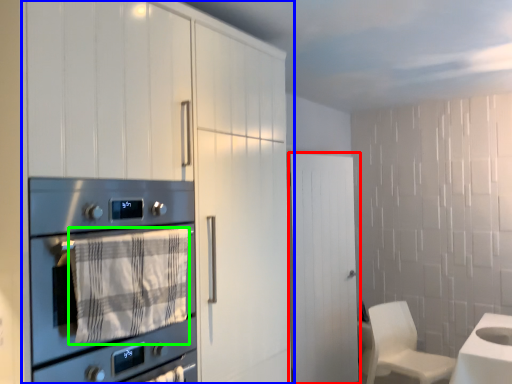
Question: Considering the real-world distances, which object is farthest from door (highlighted by a red box)? cabinetry (highlighted by a blue box) or blanket (highlighted by a green box)?

Choices:
 (A) cabinetry
 (B) blanket

Answer: (B)